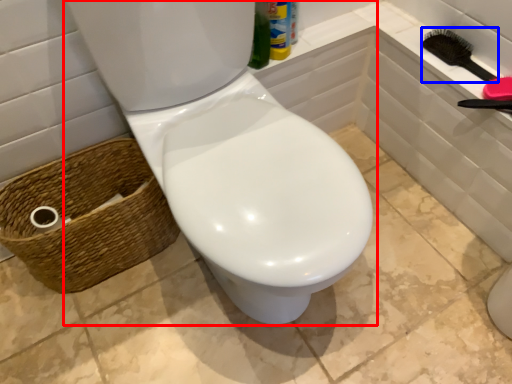
Question: Which object is closer to the camera taking this photo, toilet (highlighted by a red box) or brush (highlighted by a blue box)?

Choices:
 (A) toilet
 (B) brush

Answer: (A)